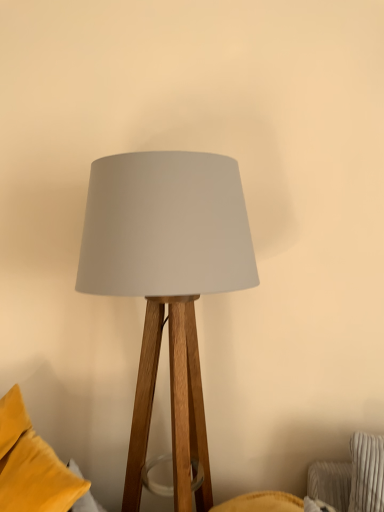
Question: Considering the positions of velvet yellow pillow at lower left and matte wood lamp at center in the image, is velvet yellow pillow at lower left taller or shorter than matte wood lamp at center?

Choices:
 (A) tall
 (B) short

Answer: (B)

Question: Based on their sizes in the image, would you say velvet yellow pillow at lower left is bigger or smaller than matte wood lamp at center?

Choices:
 (A) small
 (B) big

Answer: (A)

Question: Considering the positions of velvet yellow pillow at lower left and matte wood lamp at center in the image, is velvet yellow pillow at lower left wider or thinner than matte wood lamp at center?

Choices:
 (A) thin
 (B) wide

Answer: (A)

Question: Visually, is matte wood lamp at center positioned to the left or to the right of velvet yellow pillow at lower left?

Choices:
 (A) right
 (B) left

Answer: (A)

Question: Does point (180, 371) appear closer or farther from the camera than point (31, 490)?

Choices:
 (A) farther
 (B) closer

Answer: (A)

Question: In terms of height, does matte wood lamp at center look taller or shorter compared to velvet yellow pillow at lower left?

Choices:
 (A) short
 (B) tall

Answer: (B)

Question: Is matte wood lamp at center bigger or smaller than velvet yellow pillow at lower left?

Choices:
 (A) small
 (B) big

Answer: (B)